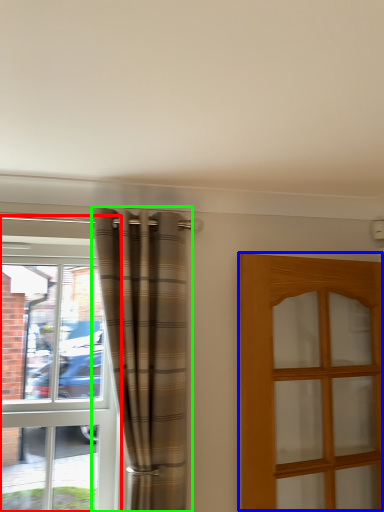
Question: Which is nearer to the window (highlighted by a red box)? door (highlighted by a blue box) or curtain (highlighted by a green box).

Choices:
 (A) door
 (B) curtain

Answer: (B)